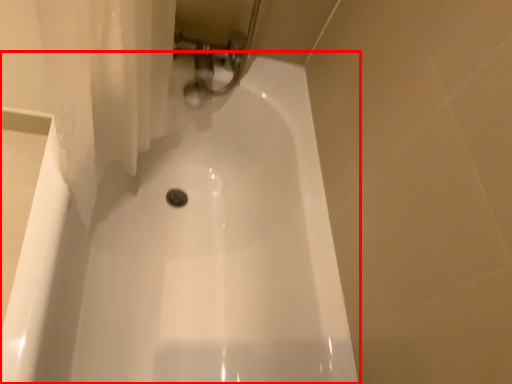
Question: From the image's perspective, where is bathtub (annotated by the red box) located relative to plumbing fixture?

Choices:
 (A) above
 (B) below

Answer: (B)